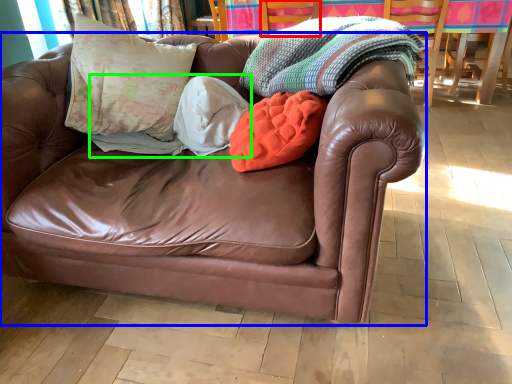
Question: Which is nearer to the armchair (highlighted by a red box)? studio couch (highlighted by a blue box) or blanket (highlighted by a green box).

Choices:
 (A) studio couch
 (B) blanket

Answer: (B)